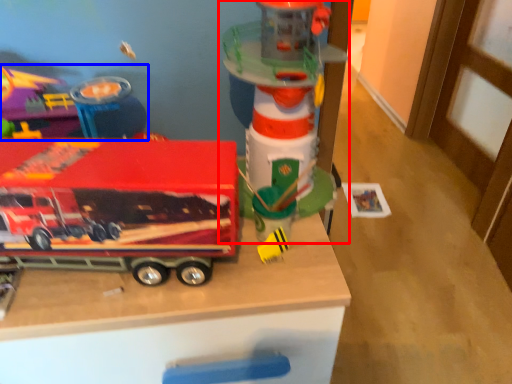
Question: Which point is closer to the camera, toy (highlighted by a red box) or toy (highlighted by a blue box)?

Choices:
 (A) toy
 (B) toy

Answer: (A)